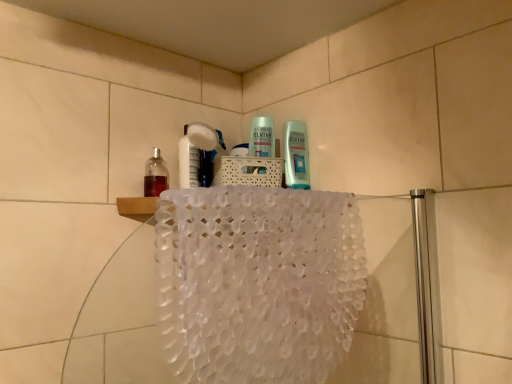
Question: Is there a large distance between translucent plastic bottle at upper left and translucent plastic bath towel at upper center?

Choices:
 (A) no
 (B) yes

Answer: (A)

Question: Is translucent plastic bottle at upper left turned away from translucent plastic bath towel at upper center?

Choices:
 (A) no
 (B) yes

Answer: (A)

Question: Considering the relative positions of translucent plastic bottle at upper left and translucent plastic bath towel at upper center in the image provided, is translucent plastic bottle at upper left behind translucent plastic bath towel at upper center?

Choices:
 (A) yes
 (B) no

Answer: (A)

Question: Is translucent plastic bottle at upper left at the right side of translucent plastic bath towel at upper center?

Choices:
 (A) yes
 (B) no

Answer: (B)

Question: From a real-world perspective, is translucent plastic bottle at upper left over translucent plastic bath towel at upper center?

Choices:
 (A) yes
 (B) no

Answer: (A)

Question: Is translucent plastic bottle at upper left shorter than translucent plastic bath towel at upper center?

Choices:
 (A) yes
 (B) no

Answer: (A)

Question: Can you confirm if translucent plastic bath towel at upper center is positioned to the right of translucent plastic bottle at upper left?

Choices:
 (A) no
 (B) yes

Answer: (B)

Question: Can you confirm if translucent plastic bath towel at upper center is smaller than translucent plastic bottle at upper left?

Choices:
 (A) no
 (B) yes

Answer: (A)

Question: Considering the relative sizes of translucent plastic bath towel at upper center and translucent plastic bottle at upper left in the image provided, is translucent plastic bath towel at upper center bigger than translucent plastic bottle at upper left?

Choices:
 (A) yes
 (B) no

Answer: (A)

Question: Is translucent plastic bath towel at upper center directly adjacent to translucent plastic bottle at upper left?

Choices:
 (A) yes
 (B) no

Answer: (B)

Question: From a real-world perspective, is translucent plastic bath towel at upper center over translucent plastic bottle at upper left?

Choices:
 (A) yes
 (B) no

Answer: (B)

Question: Is translucent plastic bath towel at upper center taller than translucent plastic bottle at upper left?

Choices:
 (A) no
 (B) yes

Answer: (B)

Question: Considering the positions of point (151, 157) and point (330, 291), is point (151, 157) closer or farther from the camera than point (330, 291)?

Choices:
 (A) closer
 (B) farther

Answer: (B)